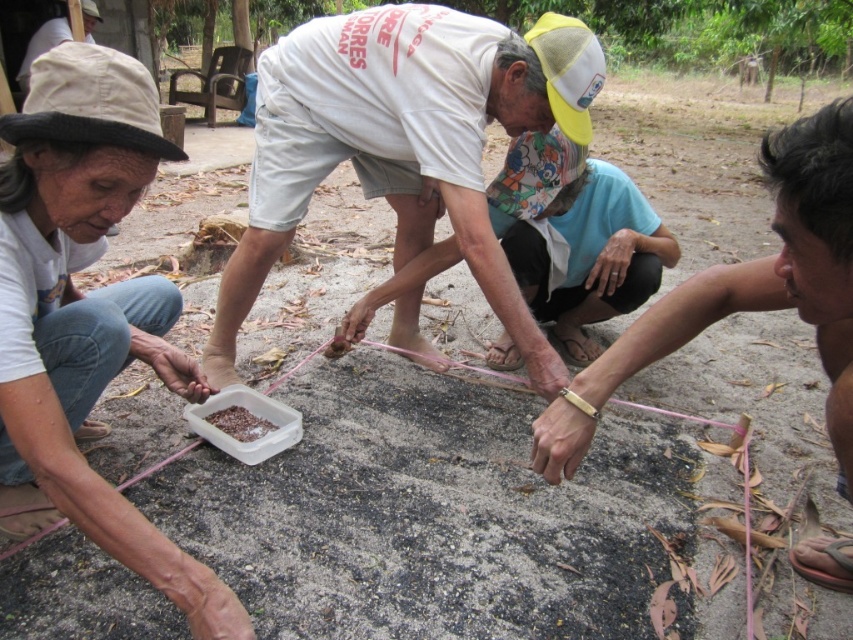
You are a gardener who needs to place a 12 inch wide gardening tool between the white cotton shirt at center and the brown leather sandal at lower right. Is there enough space between them to fit the tool?

The white cotton shirt at center and brown leather sandal at lower right are 32.80 inches apart, so yes, the 12 inch wide gardening tool can fit between them since 32.80 inches is more than enough space.

You are a gardener who wants to place a small potted plant between the gray concrete rock at lower left and the matte white cap at upper left. Which object should the plant be closer to in order to ensure it is centered between them?

The plant should be placed closer to the matte white cap at upper left since the gray concrete rock at lower left is wider than the matte white cap at upper left, balancing their widths.